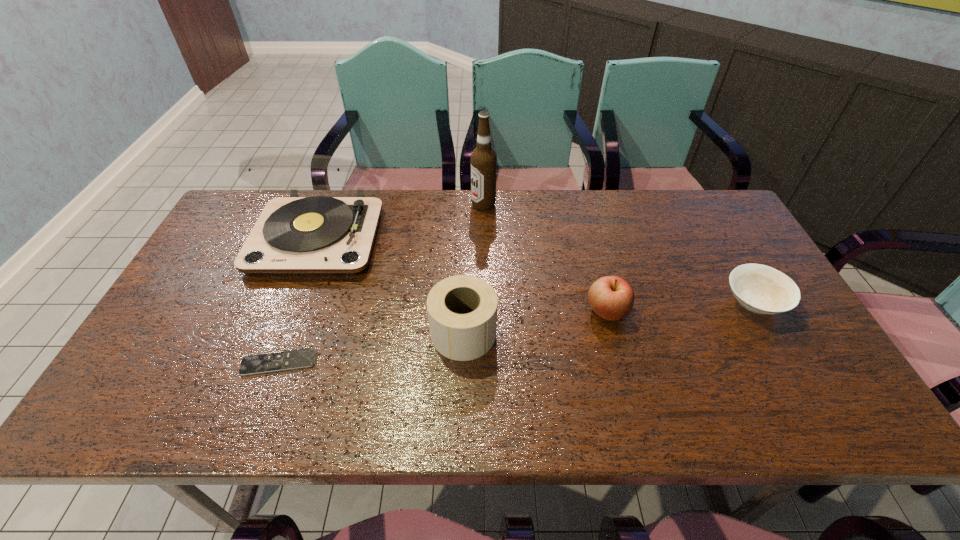
Where is `vacant area that lies between the shortest object and the alcohol`? This screenshot has height=540, width=960. vacant area that lies between the shortest object and the alcohol is located at coordinates (381, 284).

This screenshot has height=540, width=960. What are the coordinates of `unoccupied area between the shortest object and the rightmost object` in the screenshot? It's located at (516, 333).

I want to click on object that stands as the fifth closest to the remote control, so click(761, 289).

Identify which object is located as the fifth nearest to the toilet tissue. Please provide its 2D coordinates. Your answer should be formatted as a tuple, i.e. [(x, y)], where the tuple contains the x and y coordinates of a point satisfying the conditions above.

[(761, 289)]

Where is `vacant point that satisfies the following two spatial constraints: 1. on the label of the alcohol; 2. on the right side of the bowl`? vacant point that satisfies the following two spatial constraints: 1. on the label of the alcohol; 2. on the right side of the bowl is located at coordinates (485, 303).

Locate an element on the screen. The image size is (960, 540). free space in the image that satisfies the following two spatial constraints: 1. on the label of the alcohol; 2. on the right side of the fifth tallest object is located at coordinates (485, 303).

I want to click on blank space that satisfies the following two spatial constraints: 1. on the label of the apple; 2. on the right side of the alcohol, so click(x=485, y=311).

Locate an element on the screen. vacant position in the image that satisfies the following two spatial constraints: 1. with the tonearm facing the front of the record player; 2. on the right side of the apple is located at coordinates (289, 311).

Where is `vacant region that satisfies the following two spatial constraints: 1. with the tonearm facing the front of the toilet tissue; 2. on the right side of the record player`? vacant region that satisfies the following two spatial constraints: 1. with the tonearm facing the front of the toilet tissue; 2. on the right side of the record player is located at coordinates (281, 333).

Find the location of a particular element. This screenshot has width=960, height=540. vacant area that satisfies the following two spatial constraints: 1. with the tonearm facing the front of the shortest object; 2. on the left side of the record player is located at coordinates (270, 362).